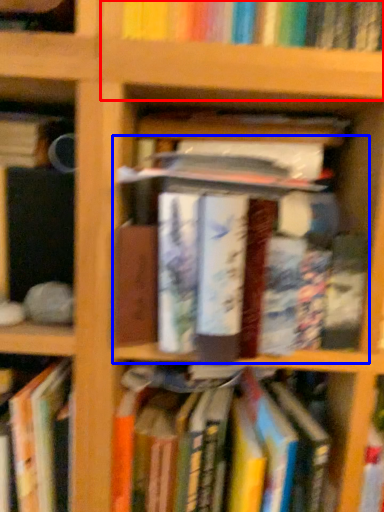
Question: Which point is closer to the camera, shelf (highlighted by a red box) or book (highlighted by a blue box)?

Choices:
 (A) shelf
 (B) book

Answer: (B)